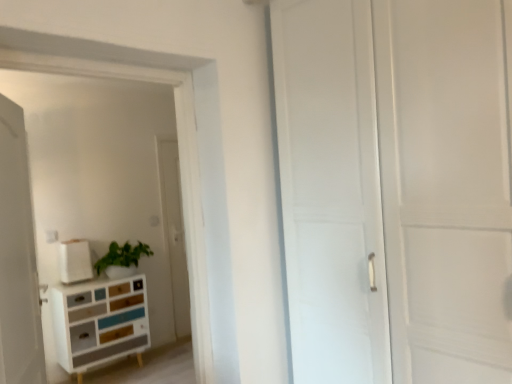
Where is `white matte box at upper left`? The height and width of the screenshot is (384, 512). white matte box at upper left is located at coordinates (74, 261).

Is multicolored wood chest of drawers at lower left completely or partially inside white matte door at left?

No, multicolored wood chest of drawers at lower left is not surrounded by white matte door at left.

From the image's perspective, is white matte door at left located above or below multicolored wood chest of drawers at lower left?

From the image's perspective, white matte door at left appears above multicolored wood chest of drawers at lower left.

Is white matte door at left oriented towards multicolored wood chest of drawers at lower left?

No, white matte door at left does not turn towards multicolored wood chest of drawers at lower left.

Is white matte door at left to the left of multicolored wood chest of drawers at lower left from the viewer's perspective?

No.

Is multicolored wood chest of drawers at lower left not inside white matte door at left?

Indeed, multicolored wood chest of drawers at lower left is completely outside white matte door at left.

Is multicolored wood chest of drawers at lower left to the right of white matte door at left from the viewer's perspective?

No, multicolored wood chest of drawers at lower left is not to the right of white matte door at left.

Between point (71, 328) and point (23, 233), which one is positioned behind?

The point (71, 328) is behind.

Considering the relative sizes of multicolored wood chest of drawers at lower left and white matte box at upper left in the image provided, is multicolored wood chest of drawers at lower left smaller than white matte box at upper left?

No.

Can we say multicolored wood chest of drawers at lower left lies outside white matte box at upper left?

That's correct, multicolored wood chest of drawers at lower left is outside of white matte box at upper left.

Between point (94, 314) and point (72, 257), which one is positioned in front?

The point (94, 314) is more forward.

From the image's perspective, is white matte box at upper left under white matte door at left?

Correct, white matte box at upper left appears lower than white matte door at left in the image.

Consider the image. Which object is further away from the camera taking this photo, white matte box at upper left or white matte door at left?

white matte box at upper left is more distant.

Which of these two, white matte box at upper left or white matte door at left, is smaller?

With smaller size is white matte box at upper left.

How much distance is there between white matte door at left and white matte box at upper left?

They are 5.17 feet apart.

Where is `door above the white matte box at upper left (from a real-world perspective)`? Image resolution: width=512 pixels, height=384 pixels. door above the white matte box at upper left (from a real-world perspective) is located at coordinates (18, 258).

Who is shorter, white matte door at left or white matte box at upper left?

white matte box at upper left is shorter.

Is white matte door at left thinner than white matte box at upper left?

No, white matte door at left is not thinner than white matte box at upper left.

Is point (63, 253) more distant than point (141, 364)?

No.

Are white matte box at upper left and multicolored wood chest of drawers at lower left making contact?

No, white matte box at upper left is not beside multicolored wood chest of drawers at lower left.

The image size is (512, 384). What are the coordinates of `appliance on the left of multicolored wood chest of drawers at lower left` in the screenshot? It's located at (74, 261).

The height and width of the screenshot is (384, 512). Identify the location of door located above the multicolored wood chest of drawers at lower left (from the image's perspective). (18, 258).

Where is `door on the right of multicolored wood chest of drawers at lower left`? This screenshot has height=384, width=512. door on the right of multicolored wood chest of drawers at lower left is located at coordinates (18, 258).

Looking at the image, which one is located closer to white matte box at upper left, multicolored wood chest of drawers at lower left or white matte door at left?

The object closer to white matte box at upper left is multicolored wood chest of drawers at lower left.

From the image, which object appears to be nearer to multicolored wood chest of drawers at lower left, white matte door at left or white matte box at upper left?

white matte box at upper left is positioned closer to the anchor multicolored wood chest of drawers at lower left.

Looking at this image, estimate the real-world distances between objects in this image. Which object is closer to white matte door at left, white matte box at upper left or multicolored wood chest of drawers at lower left?

multicolored wood chest of drawers at lower left is closer to white matte door at left.

Looking at the image, which one is located closer to white matte box at upper left, white matte door at left or multicolored wood chest of drawers at lower left?

multicolored wood chest of drawers at lower left.

Which object lies further to the anchor point white matte door at left, multicolored wood chest of drawers at lower left or white matte box at upper left?

Based on the image, white matte box at upper left appears to be further to white matte door at left.

Which object lies further to the anchor point multicolored wood chest of drawers at lower left, white matte box at upper left or white matte door at left?

Based on the image, white matte door at left appears to be further to multicolored wood chest of drawers at lower left.

This screenshot has height=384, width=512. Find the location of `chest of drawers between white matte door at left and white matte box at upper left from front to back`. chest of drawers between white matte door at left and white matte box at upper left from front to back is located at coordinates (99, 322).